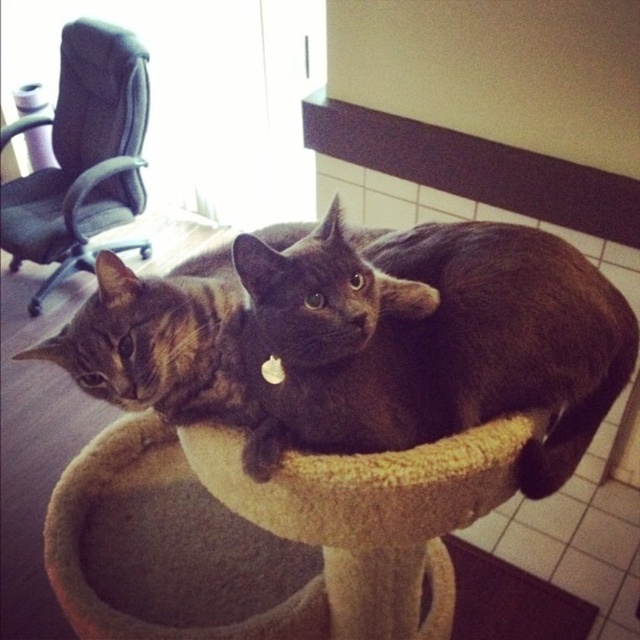
Does beige carpeted cat bed at center appear on the left side of shiny black cat at center?

Correct, you'll find beige carpeted cat bed at center to the left of shiny black cat at center.

Based on the photo, which of these two, beige carpeted cat bed at center or shiny black cat at center, stands shorter?

Standing shorter between the two is shiny black cat at center.

Where is `beige carpeted cat bed at center`? beige carpeted cat bed at center is located at coordinates (266, 534).

Does shiny black cat at center appear on the left side of black fabric swivel chair at left?

No, shiny black cat at center is not to the left of black fabric swivel chair at left.

Is shiny black cat at center bigger than black fabric swivel chair at left?

Incorrect, shiny black cat at center is not larger than black fabric swivel chair at left.

Is point (492, 296) positioned after point (124, 86)?

That is False.

You are a GUI agent. You are given a task and a screenshot of the screen. Output one action in this format:
    pyautogui.click(x=<x>, y=<y>)
    Task: Click on the shiny black cat at center
    
    Given the screenshot: What is the action you would take?
    pyautogui.click(x=428, y=339)

Who is higher up, beige carpeted cat bed at center or black fabric swivel chair at left?

black fabric swivel chair at left is above.

Measure the distance between beige carpeted cat bed at center and camera.

beige carpeted cat bed at center is 32.17 inches from camera.

Locate an element on the screen. This screenshot has width=640, height=640. beige carpeted cat bed at center is located at coordinates (266, 534).